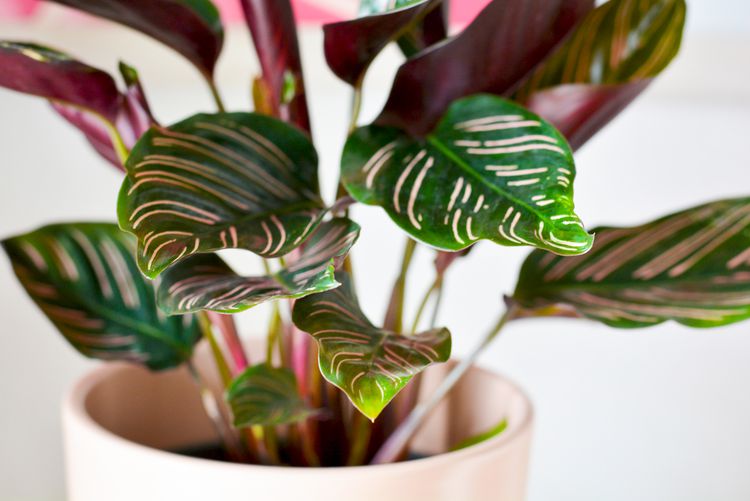
You are a GUI agent. You are given a task and a screenshot of the screen. Output one action in this format:
    pyautogui.click(x=<x>, y=<y>)
    Task: Click on the area inside planter
    
    Given the screenshot: What is the action you would take?
    pyautogui.click(x=175, y=389), pyautogui.click(x=204, y=445), pyautogui.click(x=438, y=433)